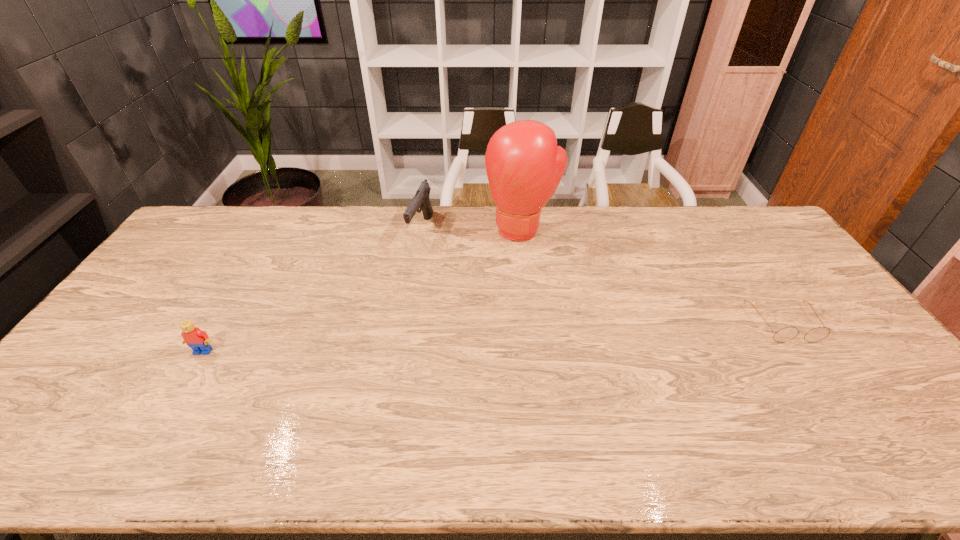
The height and width of the screenshot is (540, 960). In order to click on the nearest object in this screenshot , I will do `click(198, 340)`.

This screenshot has width=960, height=540. What are the coordinates of `the second shortest object` in the screenshot? It's located at (198, 340).

Find the location of a particular element. This screenshot has height=540, width=960. the second nearest object is located at coordinates (786, 334).

At what (x,y) coordinates should I click in order to perform the action: click on the rightmost object. Please return your answer as a coordinate pair (x, y). Looking at the image, I should click on (786, 334).

This screenshot has width=960, height=540. I want to click on the second object from right to left, so click(524, 166).

You are a GUI agent. You are given a task and a screenshot of the screen. Output one action in this format:
    pyautogui.click(x=<x>, y=<y>)
    Task: Click on the tallest object
    The image size is (960, 540).
    Given the screenshot: What is the action you would take?
    pyautogui.click(x=524, y=166)

Locate an element on the screen. the third shortest object is located at coordinates (421, 200).

Find the location of a particular element. Image resolution: width=960 pixels, height=540 pixels. the second object from left to right is located at coordinates click(x=421, y=200).

I want to click on free space located on the face of the leftmost object, so click(x=170, y=408).

This screenshot has height=540, width=960. I want to click on vacant space located 0.070m on the temples of the rightmost object, so click(x=812, y=366).